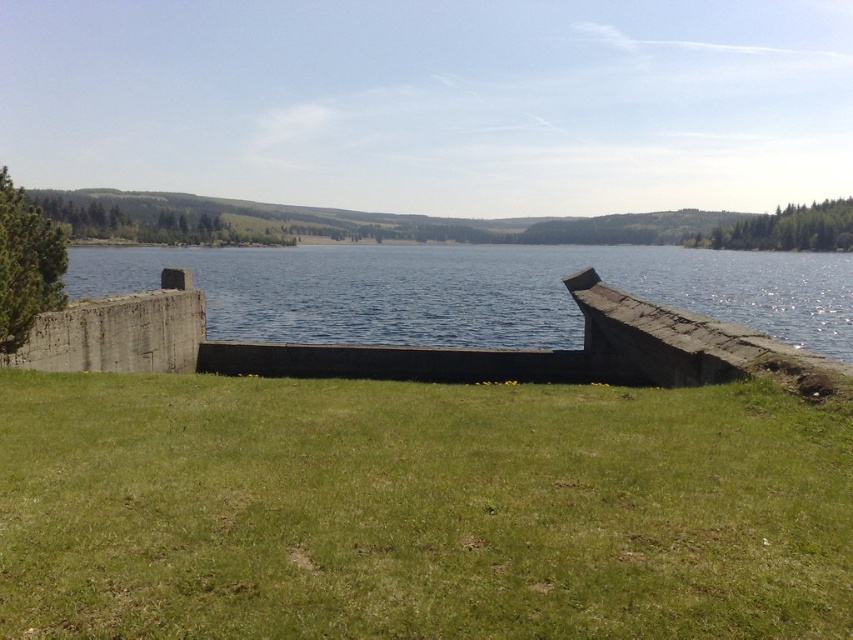
Measure the distance between blue concrete water at center and gray concrete wall at left.

blue concrete water at center and gray concrete wall at left are 85.89 meters apart from each other.

Who is lower down, blue concrete water at center or gray concrete wall at left?

gray concrete wall at left

Identify the location of blue concrete water at center. (479, 291).

Does point (138, 584) lie in front of point (160, 369)?

Yes, it is in front of point (160, 369).

Can you confirm if green grassy at center is thinner than gray concrete wall at left?

Yes, green grassy at center is thinner than gray concrete wall at left.

Is point (572, 525) positioned in front of point (4, 355)?

Yes, point (572, 525) is closer to viewer.

Identify the location of green grassy at center. The height and width of the screenshot is (640, 853). (419, 509).

Does green grassy at center have a lesser height compared to blue concrete water at center?

Yes.

Between green grassy at center and blue concrete water at center, which one is positioned higher?

blue concrete water at center

Who is more forward, (779, 518) or (525, 340)?

Point (779, 518)

You are a GUI agent. You are given a task and a screenshot of the screen. Output one action in this format:
    pyautogui.click(x=<x>, y=<y>)
    Task: Click on the green grassy at center
    
    Given the screenshot: What is the action you would take?
    [x=419, y=509]